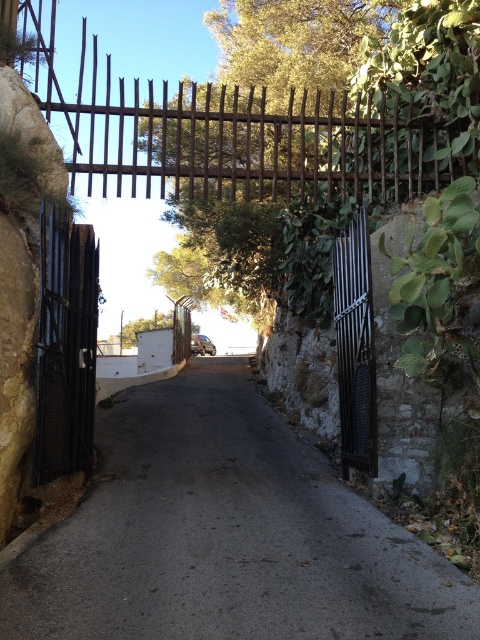
Question: Estimate the real-world distances between objects in this image. Which object is farther from the rusty metal gate at upper center?

Choices:
 (A) polished metal gate at center
 (B) dark asphalt road at center

Answer: (B)

Question: Observing the image, what is the correct spatial positioning of dark asphalt road at center in reference to polished metal gate at center?

Choices:
 (A) below
 (B) above

Answer: (A)

Question: Can you confirm if rusty metal gate at upper center is smaller than polished metal gate at center?

Choices:
 (A) no
 (B) yes

Answer: (A)

Question: Among these points, which one is nearest to the camera?

Choices:
 (A) (336, 300)
 (B) (76, 312)
 (C) (92, 125)
 (D) (432, 577)

Answer: (D)

Question: Based on their relative distances, which object is farther from the dark asphalt road at center?

Choices:
 (A) polished metal gate at center
 (B) rusty metal gate at upper center
 (C) black metal gate at left

Answer: (B)

Question: Is rusty metal gate at upper center to the left of black metal gate at left from the viewer's perspective?

Choices:
 (A) yes
 (B) no

Answer: (A)